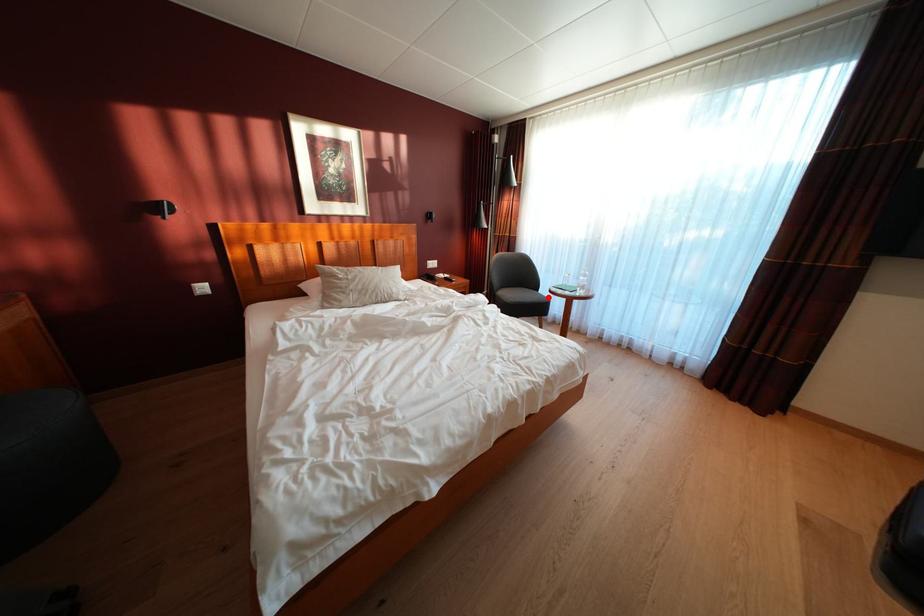
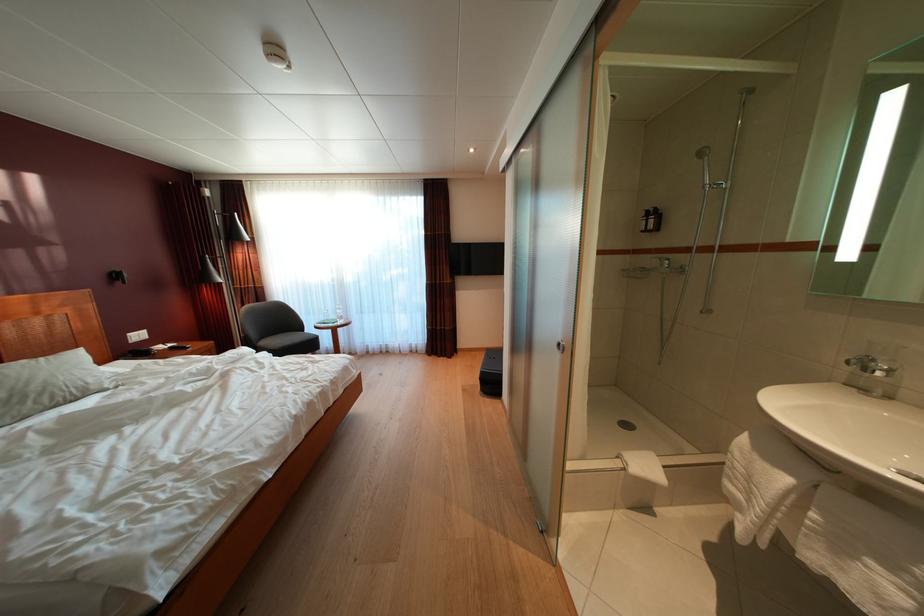
In the second image, find the point that corresponds to the highlighted location in the first image.

(314, 337)